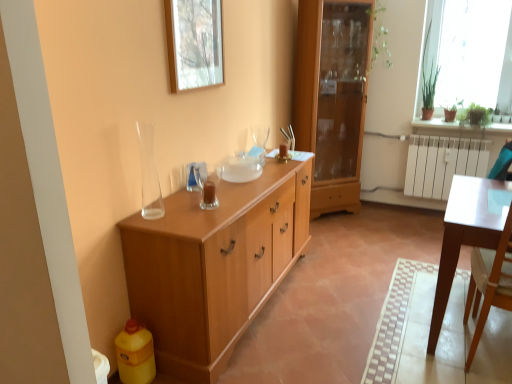
This screenshot has height=384, width=512. I want to click on vacant space situated on the left part of white glossy table at right, so click(410, 338).